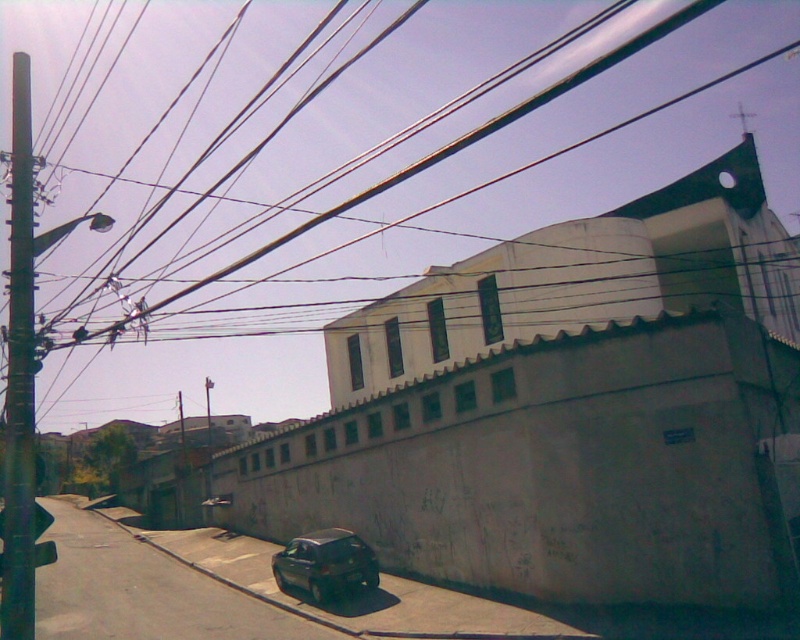
You are standing at the camera position looking at the urban street scene. There is a specific point marked at coordinates point (8, 444). If you want to place a 10 meter long banner from the camera to this point, will the banner be long enough to reach the point?

The distance of point (8, 444) from camera is 10.29 meters, so the 10 meter long banner will be 0.29 meters short and cannot reach the point.

You are standing at the entrance of the building and want to reach the metallic gray pole at left. Which direction should you walk to get there?

The metallic gray pole at left is located at point (20, 376), so you should walk towards the left side of the building to reach it.

You are a delivery person trying to park your dark gray matte car at lower center near the curb. There is a metallic gray pole at left in the way. Can you move the car to the right to avoid hitting the pole?

The metallic gray pole at left is positioned on the left side of dark gray matte car at lower center, so moving the car to the right would allow it to avoid the pole.